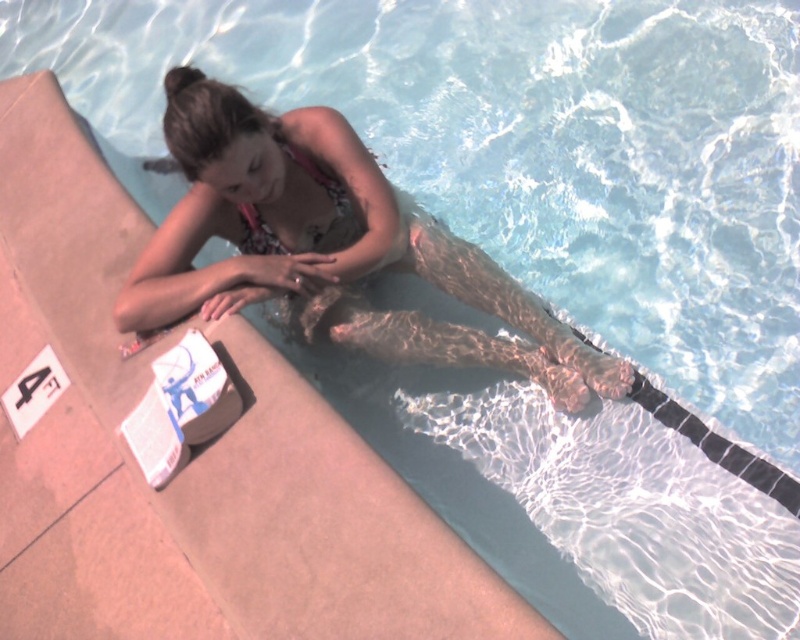
Question: Which object is closer to the camera taking this photo?

Choices:
 (A) patterned fabric bikini top at upper center
 (B) floral bikini at center

Answer: (B)

Question: Can you confirm if floral bikini at center is positioned to the right of patterned fabric bikini top at upper center?

Choices:
 (A) no
 (B) yes

Answer: (B)

Question: Is floral bikini at center smaller than patterned fabric bikini top at upper center?

Choices:
 (A) no
 (B) yes

Answer: (A)

Question: Which object is closer to the camera taking this photo?

Choices:
 (A) patterned fabric bikini top at upper center
 (B) floral bikini at center

Answer: (B)

Question: Which of the following is the closest to the observer?

Choices:
 (A) (372, 220)
 (B) (306, 168)

Answer: (A)

Question: Considering the relative positions of floral bikini at center and patterned fabric bikini top at upper center in the image provided, where is floral bikini at center located with respect to patterned fabric bikini top at upper center?

Choices:
 (A) below
 (B) above

Answer: (A)